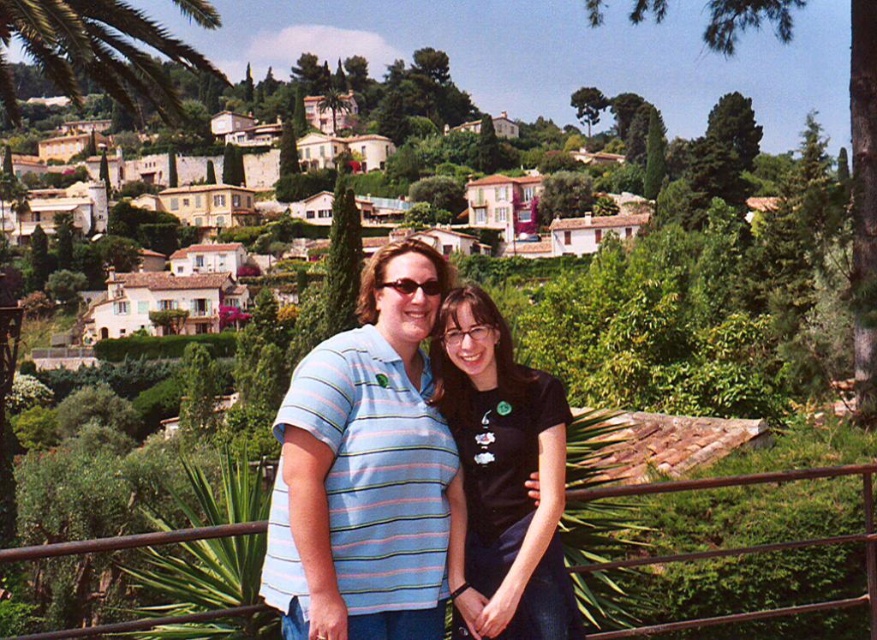
Between point (132, 28) and point (710, 620), which one is positioned in front?

Point (710, 620) is more forward.

Who is lower down, green leafy palm tree at upper left or brown metal fence at center?

Positioned lower is brown metal fence at center.

Is point (6, 12) more distant than point (871, 477)?

Yes, it is.

Where is `green leafy palm tree at upper left`? green leafy palm tree at upper left is located at coordinates (96, 52).

Does striped cotton shirt at center appear under black matte shirt at center?

Actually, striped cotton shirt at center is above black matte shirt at center.

Is striped cotton shirt at center bigger than black matte shirt at center?

A: Yes.

You are a GUI agent. You are given a task and a screenshot of the screen. Output one action in this format:
    pyautogui.click(x=<x>, y=<y>)
    Task: Click on the striped cotton shirt at center
    Image resolution: width=877 pixels, height=640 pixels.
    Given the screenshot: What is the action you would take?
    pyautogui.click(x=371, y=474)

Can you confirm if black matte shirt at center is positioned above green leafy palm tree at upper left?

Actually, black matte shirt at center is below green leafy palm tree at upper left.

Does point (529, 376) come behind point (96, 17)?

No, it is in front of (96, 17).

Is point (483, 369) positioned after point (68, 84)?

No.

Where is `black matte shirt at center`? The height and width of the screenshot is (640, 877). black matte shirt at center is located at coordinates (505, 470).